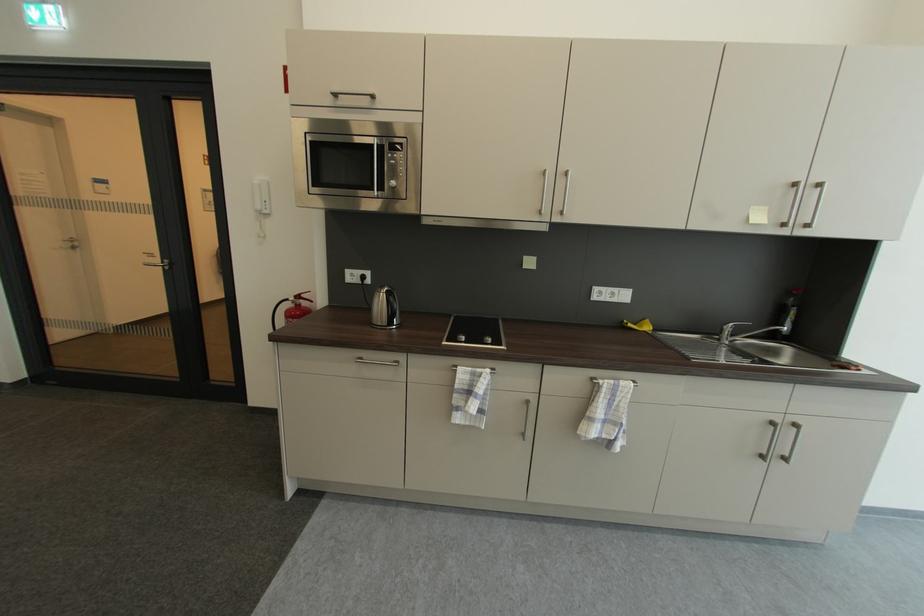
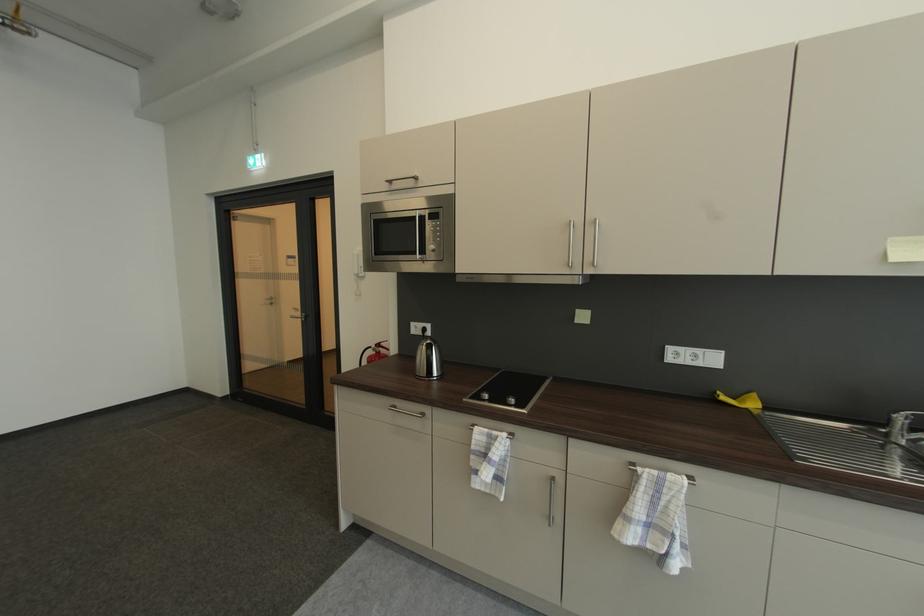
Locate, in the second image, the point that corresponds to point (163, 262) in the first image.

(305, 315)